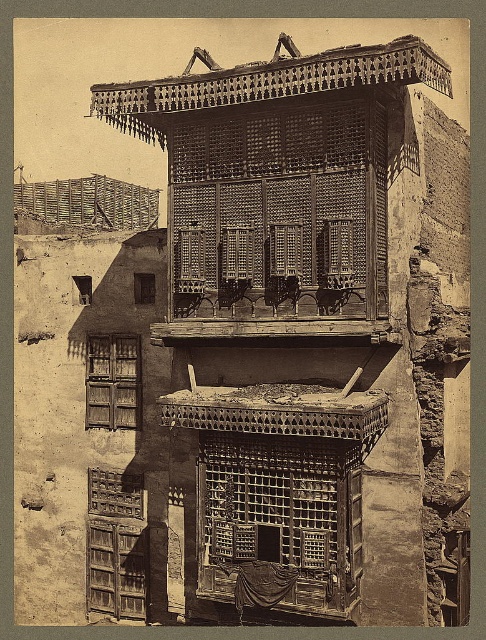
You are an architect examining this historical building. You notice the rustic wood balcony at upper center and the rustic wooden lattice at center. Which of these two elements has a greater overall size?

The rustic wood balcony at upper center is larger in size than the rustic wooden lattice at center.

You are an architect examining this historical building. You notice the rustic wood balcony at upper center and the rustic wooden lattice at center. Which of these two features is positioned to the left in the image?

The rustic wood balcony at upper center is positioned to the left of the rustic wooden lattice at center.

You are an architect examining this historical building. You notice the rustic wood balcony at upper center and the rustic wooden lattice at center. Which structure is located higher up in the image?

The rustic wood balcony at upper center is positioned under the rustic wooden lattice at center, so the rustic wooden lattice at center is higher up in the image.